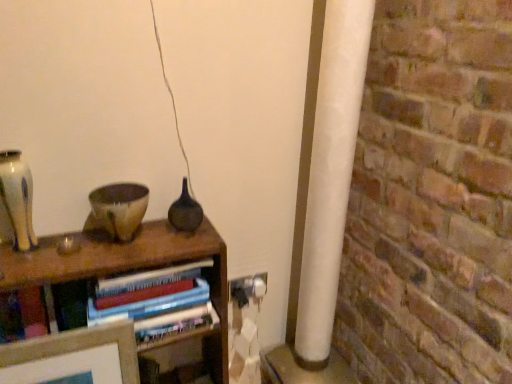
You are a GUI agent. You are given a task and a screenshot of the screen. Output one action in this format:
    pyautogui.click(x=<x>, y=<y>)
    Task: Click on the empty space that is to the right of matte beige vase at left, the 1th glass vase viewed from the front
    
    Given the screenshot: What is the action you would take?
    pyautogui.click(x=68, y=256)